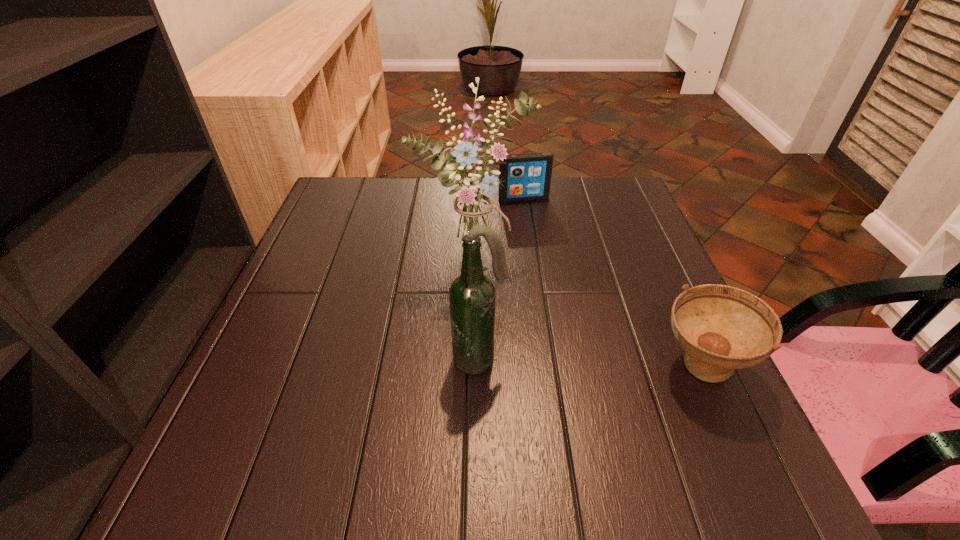
In the image, there is a desktop. At what (x,y) coordinates should I click in order to perform the action: click on vacant space at the far left corner. Please return your answer as a coordinate pair (x, y). The width and height of the screenshot is (960, 540). Looking at the image, I should click on (353, 222).

What are the coordinates of `free space at the near right corner of the desktop` in the screenshot? It's located at (681, 422).

Locate an element on the screen. empty space between the iPod and the rightmost object is located at coordinates (612, 282).

This screenshot has height=540, width=960. I want to click on empty space between the soup bowl and the beer bottle, so click(x=589, y=363).

The image size is (960, 540). In order to click on free space between the soup bowl and the third nearest object in this screenshot , I will do 587,315.

Locate an element on the screen. vacant point located between the iPod and the soup bowl is located at coordinates (612, 282).

You are a GUI agent. You are given a task and a screenshot of the screen. Output one action in this format:
    pyautogui.click(x=<x>, y=<y>)
    Task: Click on the object that is the third closest one to the iPod
    This screenshot has height=540, width=960.
    Given the screenshot: What is the action you would take?
    pyautogui.click(x=472, y=296)

Point out which object is positioned as the second nearest to the beer bottle. Please provide its 2D coordinates. Your answer should be formatted as a tuple, i.e. [(x, y)], where the tuple contains the x and y coordinates of a point satisfying the conditions above.

[(721, 328)]

Locate an element on the screen. vacant space that satisfies the following two spatial constraints: 1. on the front side of the farthest object; 2. on the right side of the rightmost object is located at coordinates (546, 367).